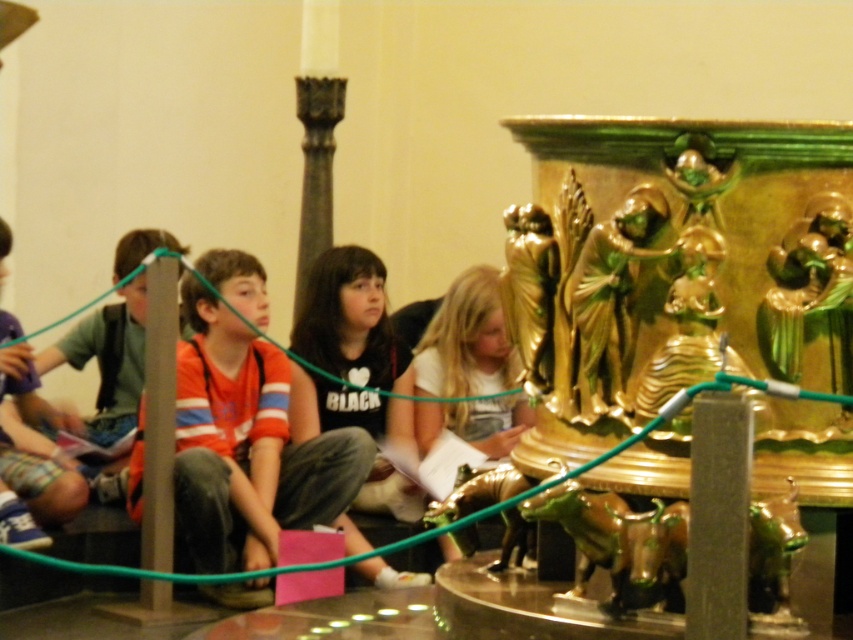
Which is more to the right, white matte shirt at center or matte green backpack at left?

white matte shirt at center is more to the right.

Can you confirm if white matte shirt at center is wider than matte green backpack at left?

Yes, white matte shirt at center is wider than matte green backpack at left.

Where is `white matte shirt at center`? This screenshot has width=853, height=640. white matte shirt at center is located at coordinates (466, 340).

Identify the location of white matte shirt at center. The height and width of the screenshot is (640, 853). (466, 340).

Who is taller, black matte shirt at center or white matte shirt at center?

With more height is white matte shirt at center.

Between black matte shirt at center and white matte shirt at center, which one appears on the left side from the viewer's perspective?

black matte shirt at center

Is point (369, 380) in front of point (466, 310)?

That is False.

Where is `black matte shirt at center`? This screenshot has width=853, height=640. black matte shirt at center is located at coordinates (350, 321).

How distant is orange t-shirt at center from matte green backpack at left?

orange t-shirt at center is 7.21 meters from matte green backpack at left.

Between point (270, 493) and point (129, 404), which one is positioned behind?

Point (129, 404)

I want to click on orange t-shirt at center, so click(x=248, y=433).